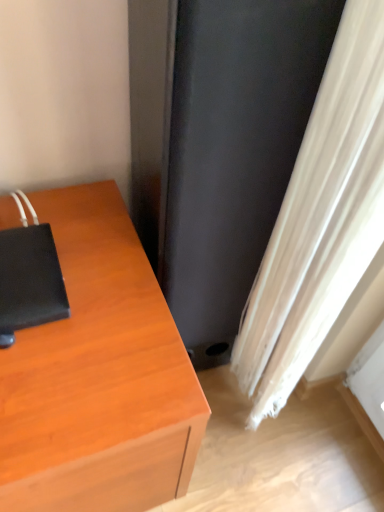
Question: Can you confirm if black matte notebook at left is shorter than black matte screen door at center?

Choices:
 (A) yes
 (B) no

Answer: (A)

Question: Considering the relative positions of black matte notebook at left and black matte screen door at center in the image provided, is black matte notebook at left in front of black matte screen door at center?

Choices:
 (A) no
 (B) yes

Answer: (A)

Question: From the image's perspective, is black matte notebook at left beneath black matte screen door at center?

Choices:
 (A) no
 (B) yes

Answer: (B)

Question: Are black matte notebook at left and black matte screen door at center making contact?

Choices:
 (A) no
 (B) yes

Answer: (A)

Question: Is black matte notebook at left facing towards black matte screen door at center?

Choices:
 (A) yes
 (B) no

Answer: (B)

Question: From a real-world perspective, is black matte notebook at left positioned over black matte screen door at center based on gravity?

Choices:
 (A) no
 (B) yes

Answer: (B)

Question: Is black matte notebook at left at the back of white textured curtain at lower right?

Choices:
 (A) no
 (B) yes

Answer: (A)

Question: Is the depth of white textured curtain at lower right less than that of black matte notebook at left?

Choices:
 (A) yes
 (B) no

Answer: (A)

Question: Would you say white textured curtain at lower right is outside black matte notebook at left?

Choices:
 (A) no
 (B) yes

Answer: (B)

Question: From the image's perspective, is white textured curtain at lower right located beneath black matte notebook at left?

Choices:
 (A) no
 (B) yes

Answer: (A)

Question: Is white textured curtain at lower right shorter than black matte notebook at left?

Choices:
 (A) no
 (B) yes

Answer: (A)

Question: Can you confirm if white textured curtain at lower right is bigger than black matte notebook at left?

Choices:
 (A) yes
 (B) no

Answer: (A)

Question: Is black matte notebook at left taller than white textured curtain at lower right?

Choices:
 (A) no
 (B) yes

Answer: (A)